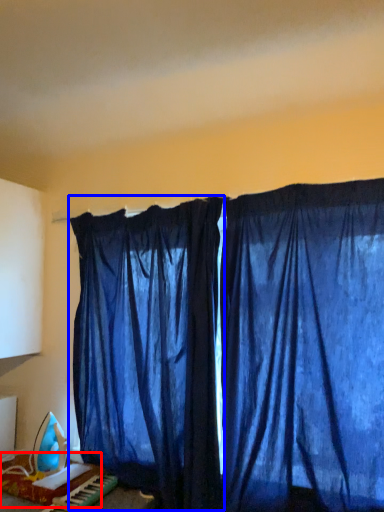
Question: Which of the following is the farthest to the observer, furniture (highlighted by a red box) or curtain (highlighted by a blue box)?

Choices:
 (A) furniture
 (B) curtain

Answer: (A)